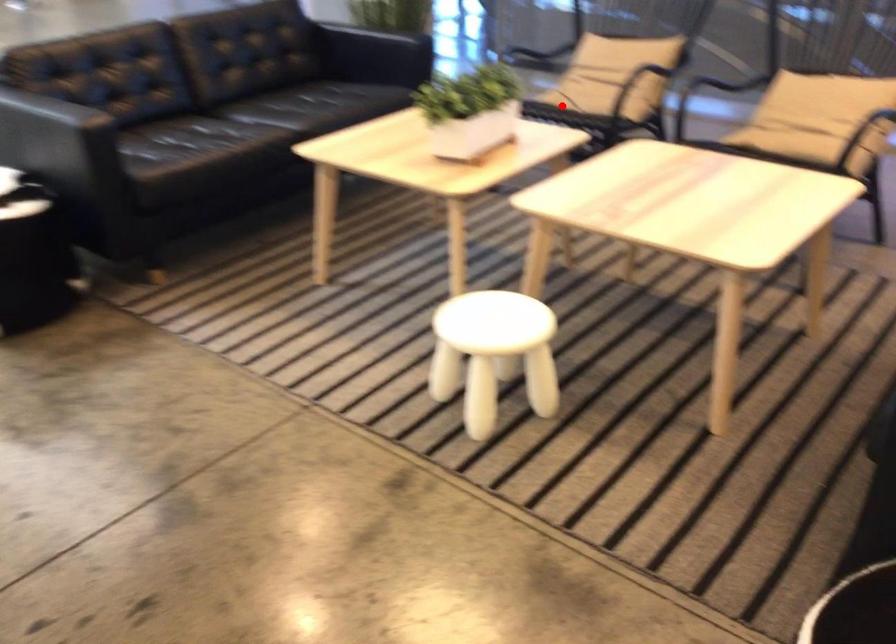
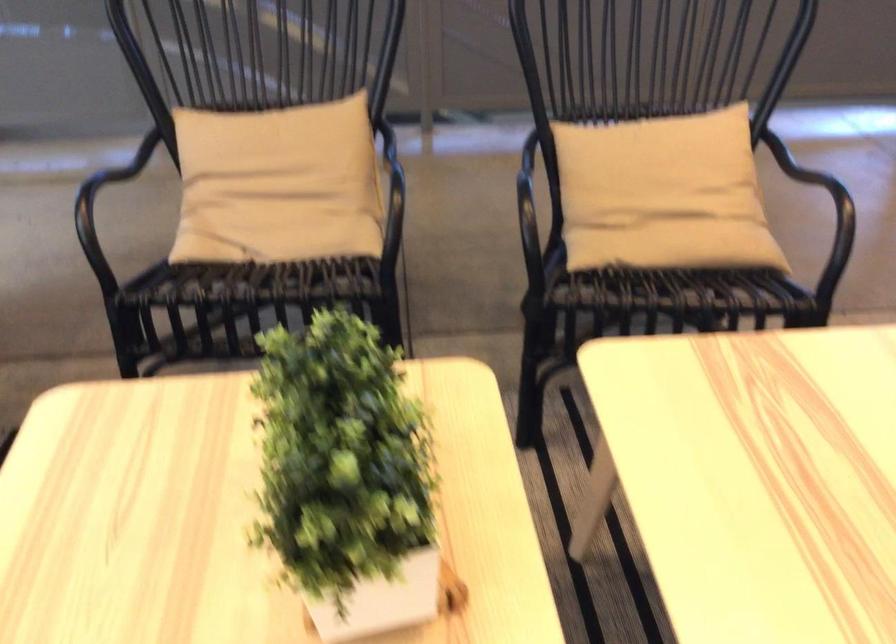
In the second image, find the point that corresponds to the highlighted location in the first image.

(268, 267)